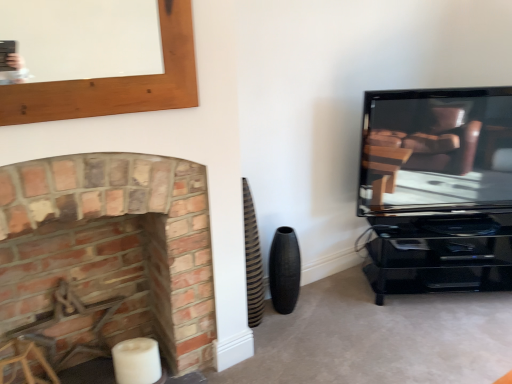
Locate an element on the screen. The height and width of the screenshot is (384, 512). free spot to the right of black textured vase at lower center is located at coordinates (315, 314).